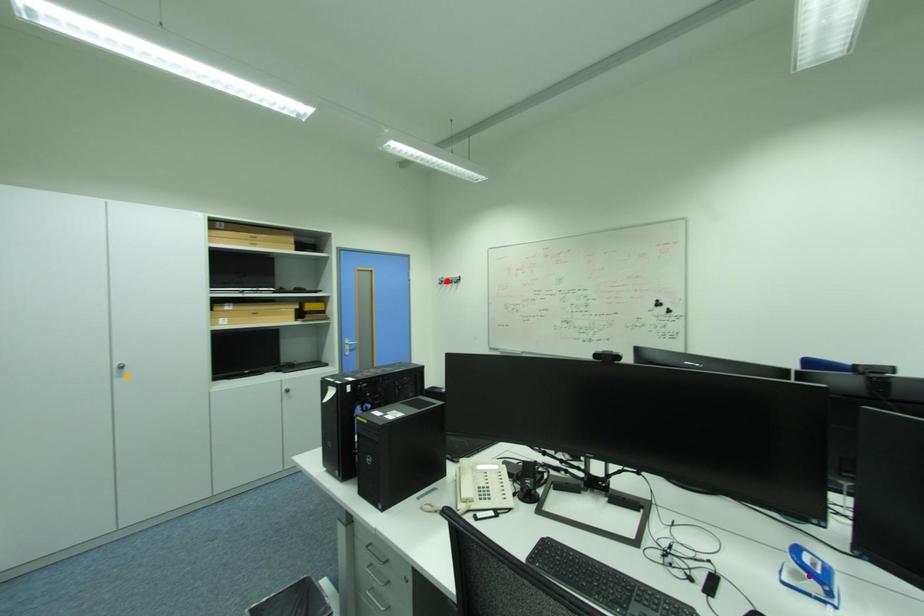
Order these from nearest to farthest:
purple point, orange point, red point

1. purple point
2. orange point
3. red point